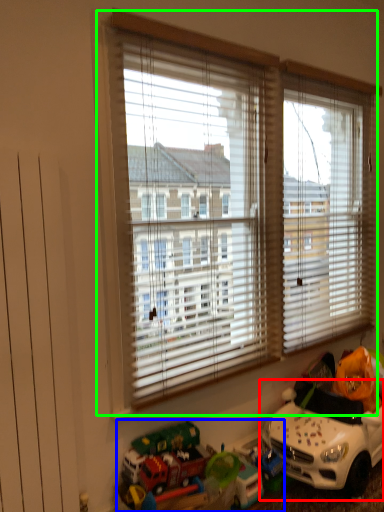
Question: Estimate the real-world distances between objects in this image. Which object is farther from toy (highlighted by a red box), toy (highlighted by a blue box) or window (highlighted by a green box)?

Choices:
 (A) toy
 (B) window

Answer: (B)